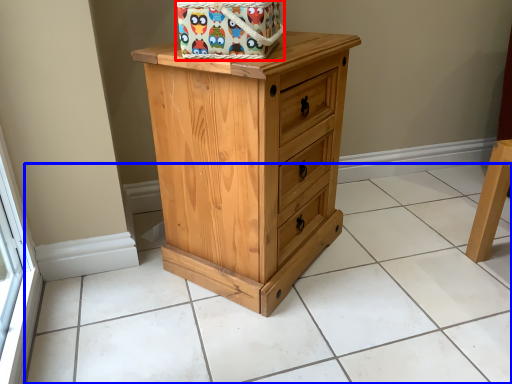
Question: Which object is further to the camera taking this photo, gift basket (highlighted by a red box) or tile (highlighted by a blue box)?

Choices:
 (A) gift basket
 (B) tile

Answer: (A)